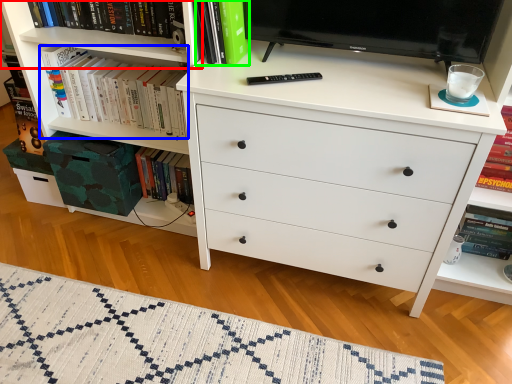
Question: Estimate the real-world distances between objects in this image. Which object is farther from shelf (highlighted by a red box), book (highlighted by a blue box) or book (highlighted by a green box)?

Choices:
 (A) book
 (B) book

Answer: (B)